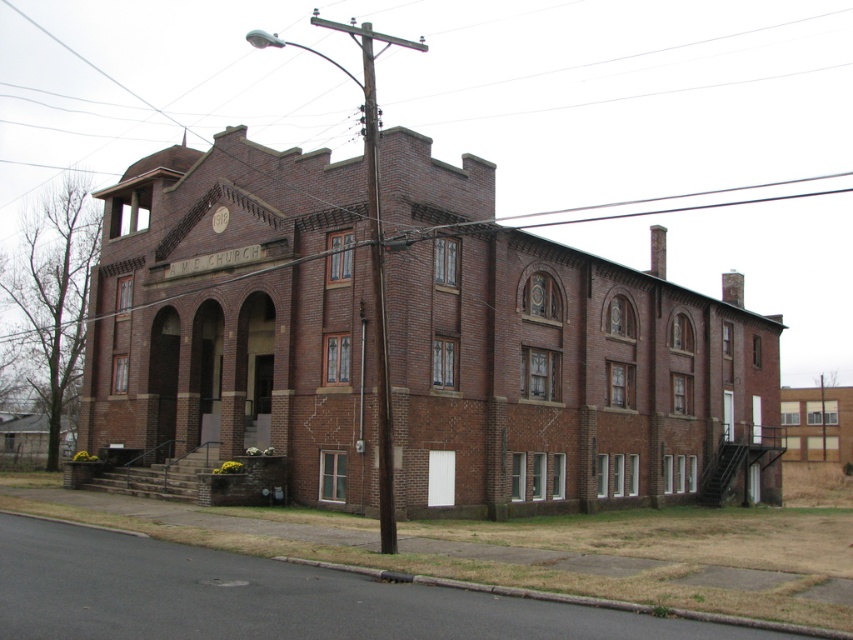
Question: Which object appears farthest from the camera in this image?

Choices:
 (A) brown brick utility pole at center
 (B) brown wooden utility pole at center

Answer: (A)

Question: Is brown brick utility pole at center thinner than brown wooden utility pole at center?

Choices:
 (A) yes
 (B) no

Answer: (B)

Question: Which object appears farthest from the camera in this image?

Choices:
 (A) brown brick utility pole at center
 (B) brown wooden utility pole at center

Answer: (A)

Question: Does brown brick utility pole at center have a lesser width compared to brown wooden utility pole at center?

Choices:
 (A) yes
 (B) no

Answer: (B)

Question: Which point appears closest to the camera in this image?

Choices:
 (A) (376, 284)
 (B) (386, 547)

Answer: (B)

Question: Does brown brick utility pole at center have a smaller size compared to brown wooden utility pole at center?

Choices:
 (A) yes
 (B) no

Answer: (B)